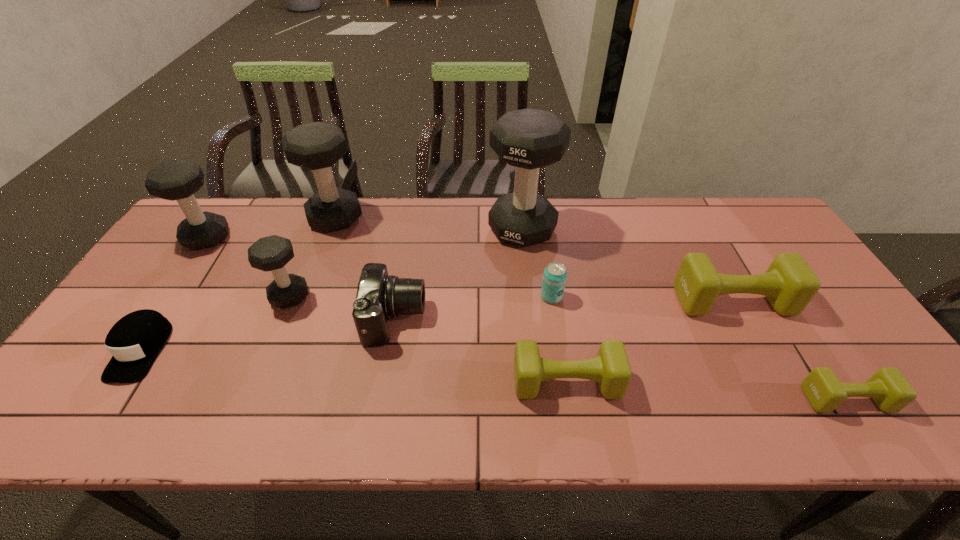
Locate an element on the screen. This screenshot has height=540, width=960. the biggest olive dumbbell is located at coordinates (789, 284).

Where is `beer can`? Image resolution: width=960 pixels, height=540 pixels. beer can is located at coordinates (555, 274).

Where is `the second shortest dumbbell`? This screenshot has height=540, width=960. the second shortest dumbbell is located at coordinates (611, 369).

What are the coordinates of `the second biggest olive dumbbell` in the screenshot? It's located at (611, 369).

At what (x,y) coordinates should I click in order to perform the action: click on black cap. Please return your answer as a coordinate pair (x, y). This screenshot has width=960, height=540. Looking at the image, I should click on (135, 340).

Find the location of `the smallest olive dumbbell`. the smallest olive dumbbell is located at coordinates (888, 388).

Locate an element on the screen. This screenshot has width=960, height=540. free space located 0.350m on the front of the biggest gray dumbbell is located at coordinates (535, 346).

Locate an element on the screen. vacant region located 0.330m on the left of the sixth shortest dumbbell is located at coordinates (207, 218).

Where is `free space located on the front of the eighth shortest object`? The image size is (960, 540). free space located on the front of the eighth shortest object is located at coordinates (170, 292).

I want to click on vacant area situated 0.250m on the front of the smallest gray dumbbell, so click(249, 396).